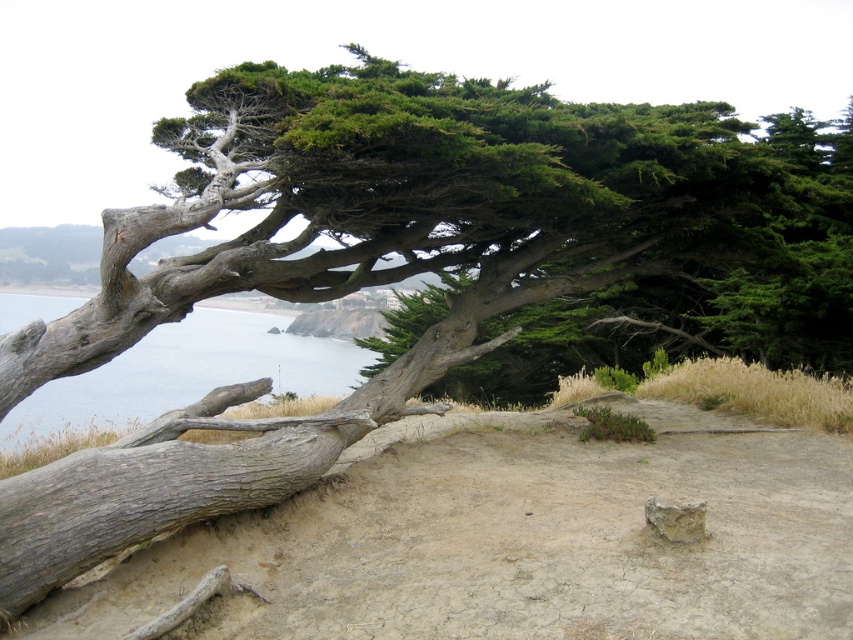
You are standing at the edge of the coastal landscape and want to place a small garden ornament exactly at the center of the dull brown dirt at center. According to the coordinates provided, where should you position the ornament?

The dull brown dirt at center is located at point (508, 541), so you should position the ornament at those coordinates to place it exactly at the center of the dull brown dirt at center.

You are an environmental scientist assessing land use in this coastal area. You need to determine which area covers more ground between the dull brown dirt at center and the blue water at left. Based on the scene, which one occupies a larger portion of the image?

The blue water at left occupies more space than the dull brown dirt at center, as the dull brown dirt at center occupies less space than blue water at left.